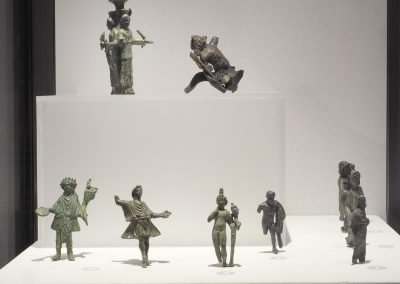
In order to click on figurines at the bottom in this screenshot , I will do `click(70, 212)`, `click(135, 218)`, `click(221, 218)`, `click(273, 212)`, `click(344, 182)`, `click(353, 193)`, `click(354, 224)`.